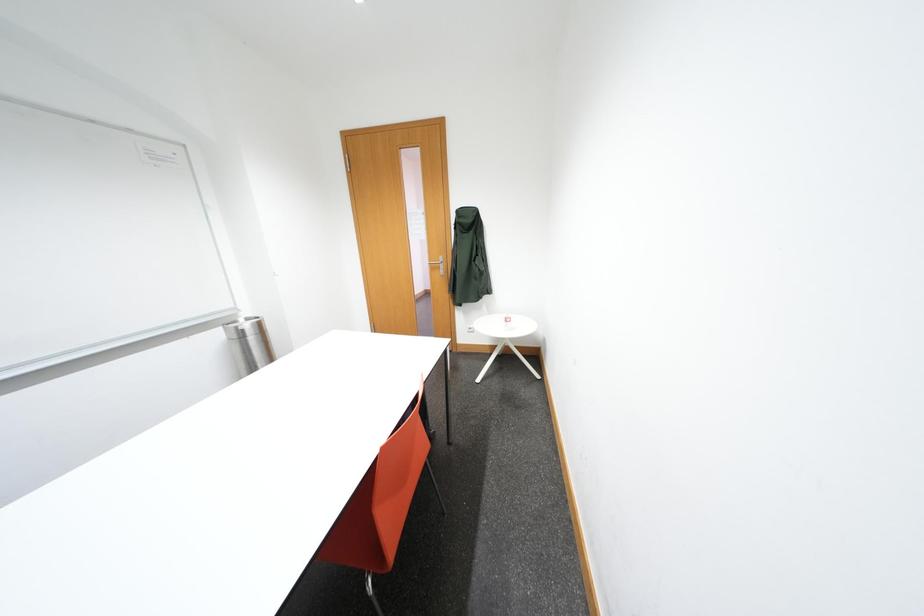
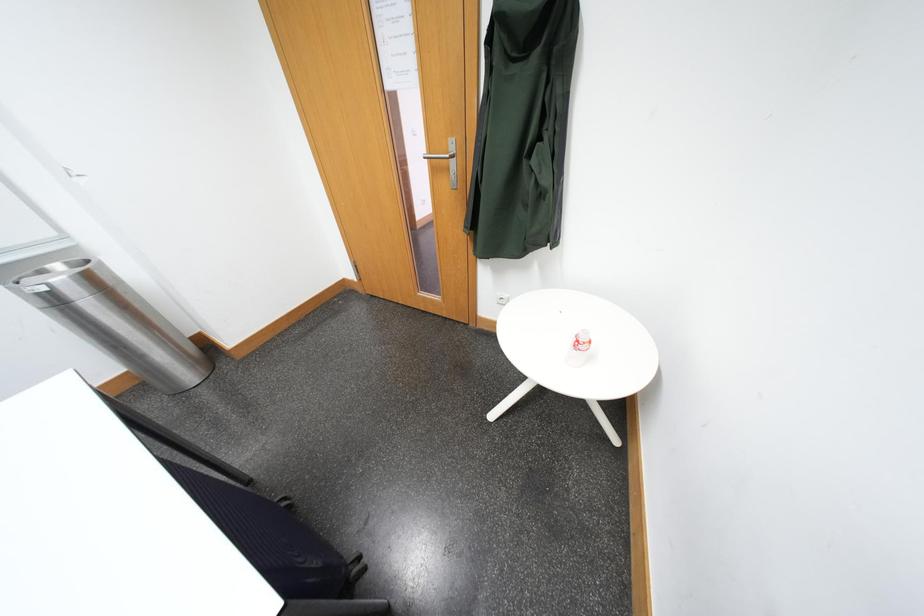
Question: The images are taken continuously from a first-person perspective. In which direction are you moving?

Choices:
 (A) Left
 (B) Right
 (C) Forward
 (D) Backward

Answer: (C)